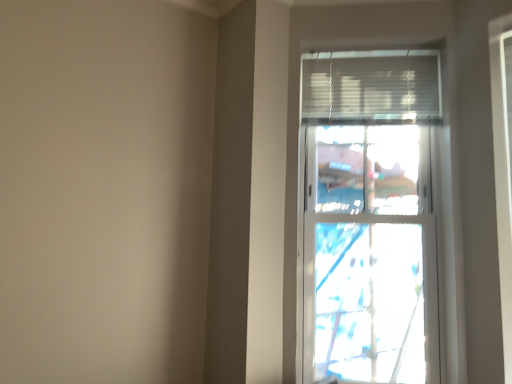
Measure the distance between point (391, 65) and camera.

Point (391, 65) and camera are 2.21 meters apart from each other.

What do you see at coordinates (370, 210) in the screenshot? The height and width of the screenshot is (384, 512). I see `transparent glass window at upper center` at bounding box center [370, 210].

Where is `transparent glass window at upper center`? transparent glass window at upper center is located at coordinates pyautogui.click(x=370, y=210).

The height and width of the screenshot is (384, 512). What are the coordinates of `transparent glass window at upper center` in the screenshot? It's located at (370, 210).